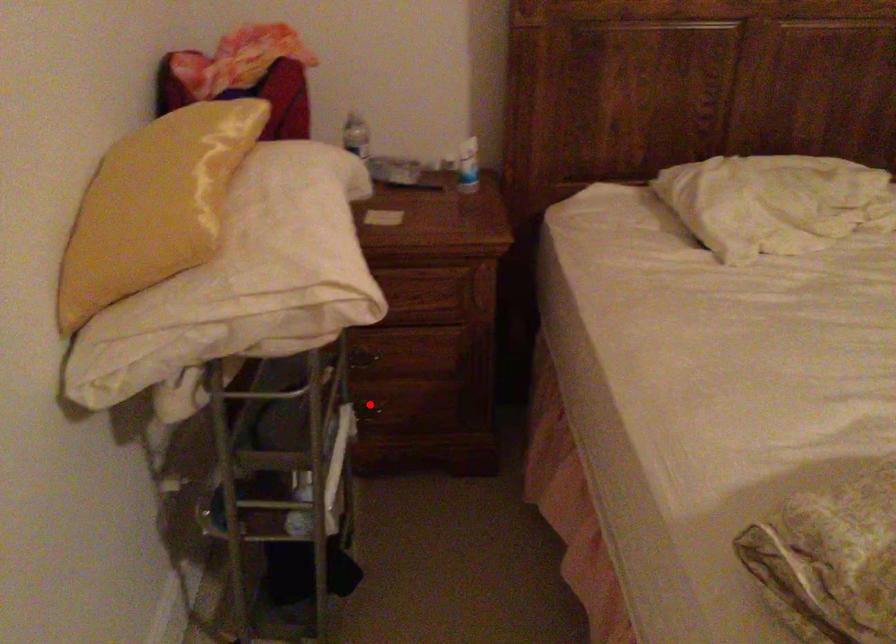
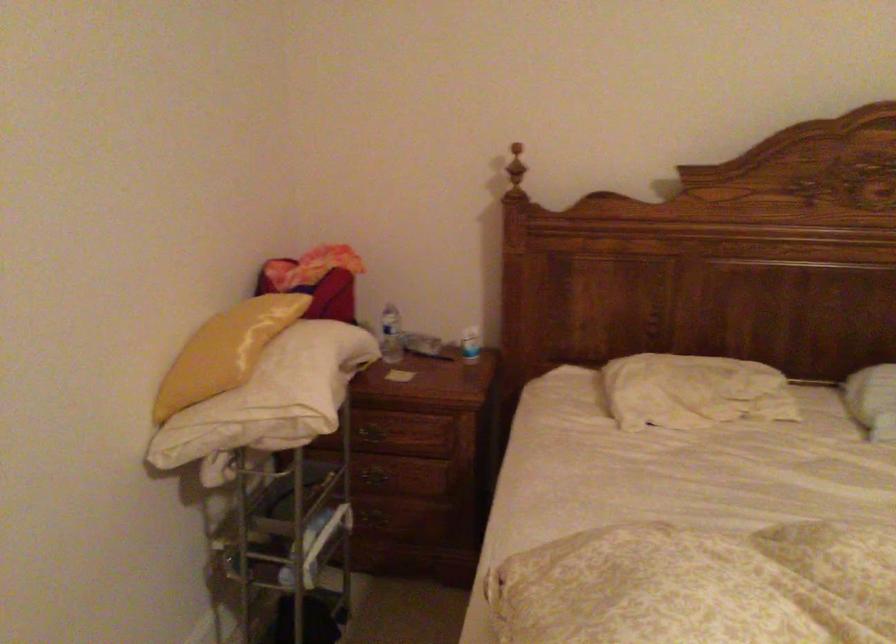
Find the pixel in the second image that matches the highlighted location in the first image.

(381, 516)